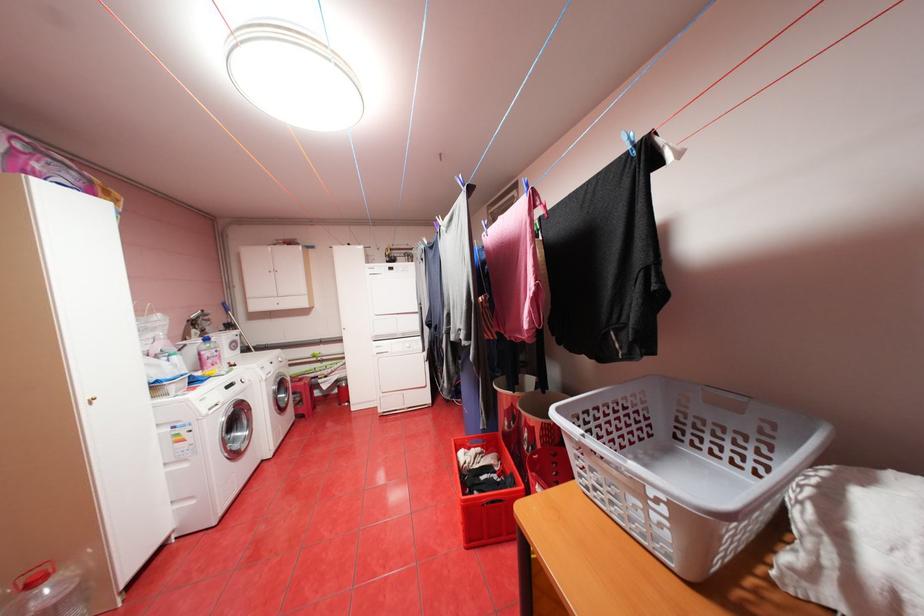
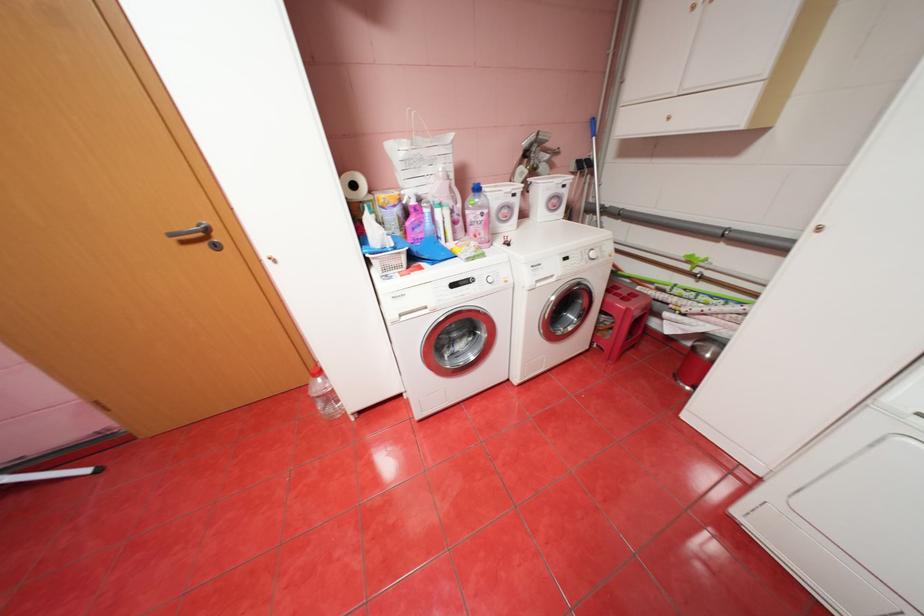
In the second image, find the point that corresponds to the point at 217,361 in the first image.

(480, 228)